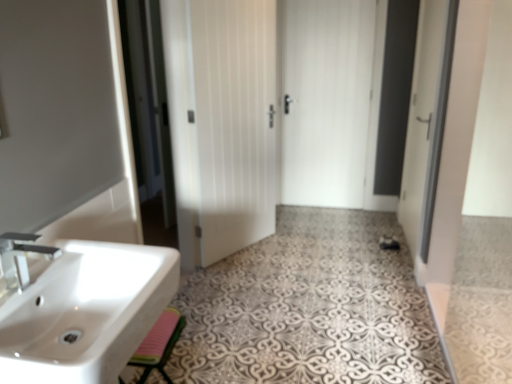
Question: Considering the positions of matte silver faucet at left and pink rubber mat at lower left in the image, is matte silver faucet at left wider or thinner than pink rubber mat at lower left?

Choices:
 (A) thin
 (B) wide

Answer: (A)

Question: In the image, is matte silver faucet at left on the left side or the right side of pink rubber mat at lower left?

Choices:
 (A) right
 (B) left

Answer: (B)

Question: Considering the real-world distances, which object is farthest from the matte silver faucet at left?

Choices:
 (A) transparent glass screen door at center, acting as the 1th screen door starting from the back
 (B) pink rubber mat at lower left
 (C) white glossy sink at lower left
 (D) white glossy door at right, marked as the first screen door in a right-to-left arrangement
 (E) white matte door at center, which is the second door from right to left

Answer: (D)

Question: Which object is the closest to the pink rubber mat at lower left?

Choices:
 (A) white matte door at center, the first door viewed from the back
 (B) white glossy door at right, the second screen door positioned from the back
 (C) white glossy sink at lower left
 (D) white matte door at center, the 2th door from the back
 (E) white glossy towel at lower left

Answer: (C)